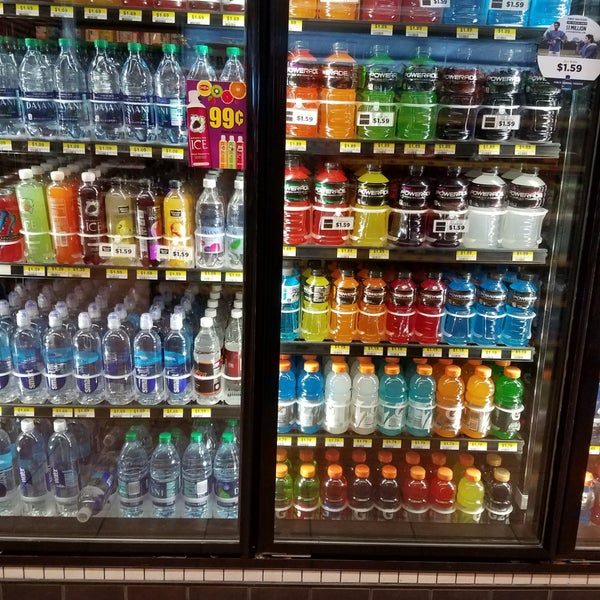
Find the location of a particular element. shelves is located at coordinates (232, 411), (190, 278), (157, 153), (17, 510), (345, 438), (355, 348), (363, 253), (364, 151).